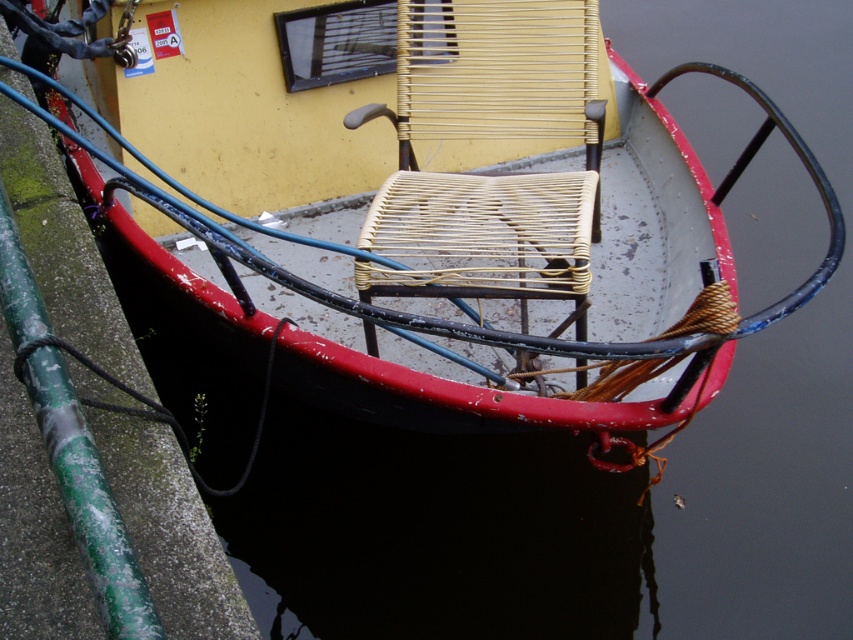
Question: Does rusty metal boat at center appear under woven wicker chair at center?

Choices:
 (A) yes
 (B) no

Answer: (B)

Question: Which point is closer to the camera?

Choices:
 (A) (645, 97)
 (B) (543, 257)

Answer: (B)

Question: Among these objects, which one is farthest from the camera?

Choices:
 (A) woven wicker chair at center
 (B) rusty metal boat at center

Answer: (A)

Question: From the image, what is the correct spatial relationship of rusty metal boat at center in relation to woven wicker chair at center?

Choices:
 (A) below
 (B) above

Answer: (B)

Question: Is rusty metal boat at center to the left of woven wicker chair at center from the viewer's perspective?

Choices:
 (A) yes
 (B) no

Answer: (A)

Question: Which point appears farthest from the camera in this image?

Choices:
 (A) (396, 172)
 (B) (474, 28)

Answer: (B)